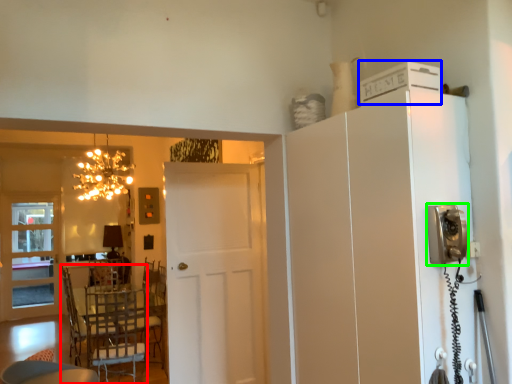
Question: Based on their relative distances, which object is farther from chair (highlighted by a red box)? Choose from appliance (highlighted by a blue box) and appliance (highlighted by a green box).

Choices:
 (A) appliance
 (B) appliance

Answer: (A)